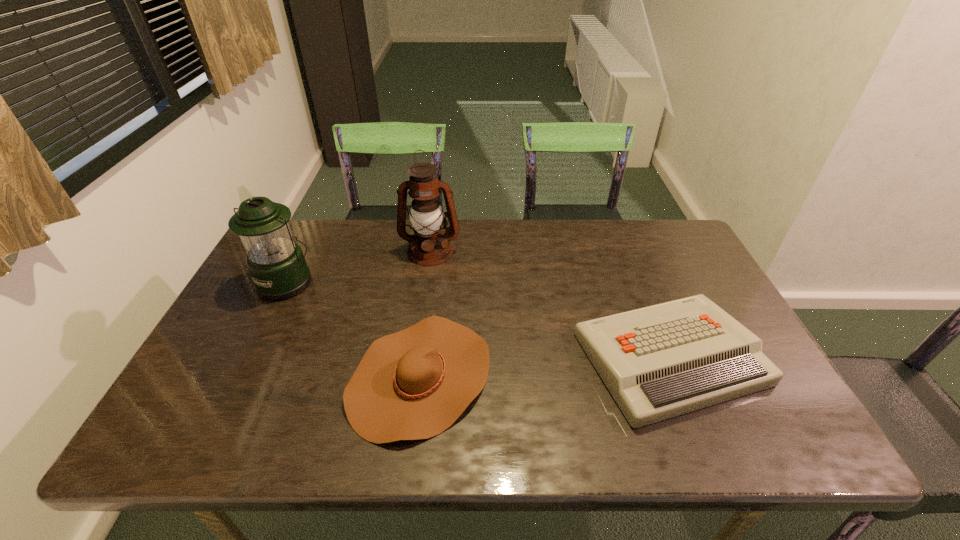
In the image, there is a desktop. Where is `vacant space at the far right corner`? This screenshot has height=540, width=960. vacant space at the far right corner is located at coordinates (690, 248).

You are a GUI agent. You are given a task and a screenshot of the screen. Output one action in this format:
    pyautogui.click(x=<x>, y=<y>)
    Task: Click on the free area in between the right lantern and the cowboy hat
    Image resolution: width=960 pixels, height=540 pixels.
    Given the screenshot: What is the action you would take?
    pyautogui.click(x=425, y=314)

I want to click on free point between the cowboy hat and the taller lantern, so click(x=425, y=314).

You are a GUI agent. You are given a task and a screenshot of the screen. Output one action in this format:
    pyautogui.click(x=<x>, y=<y>)
    Task: Click on the empty space that is in between the rightmost object and the tallest object
    
    Given the screenshot: What is the action you would take?
    pyautogui.click(x=550, y=305)

You are a GUI agent. You are given a task and a screenshot of the screen. Output one action in this format:
    pyautogui.click(x=<x>, y=<y>)
    Task: Click on the vacant space in between the rightmost object and the tallest object
    This screenshot has height=540, width=960.
    Given the screenshot: What is the action you would take?
    pyautogui.click(x=550, y=305)

Where is `vacant space that's between the computer keyboard and the right lantern`? This screenshot has height=540, width=960. vacant space that's between the computer keyboard and the right lantern is located at coordinates click(x=550, y=305).

In order to click on empty location between the cowboy hat and the right lantern in this screenshot , I will do `click(425, 314)`.

Locate an element on the screen. Image resolution: width=960 pixels, height=540 pixels. free space between the cowboy hat and the tallest object is located at coordinates (425, 314).

Where is `free space between the cowboy hat and the left lantern`? The image size is (960, 540). free space between the cowboy hat and the left lantern is located at coordinates (353, 329).

The height and width of the screenshot is (540, 960). What are the coordinates of `blank region between the right lantern and the rightmost object` in the screenshot? It's located at (550, 305).